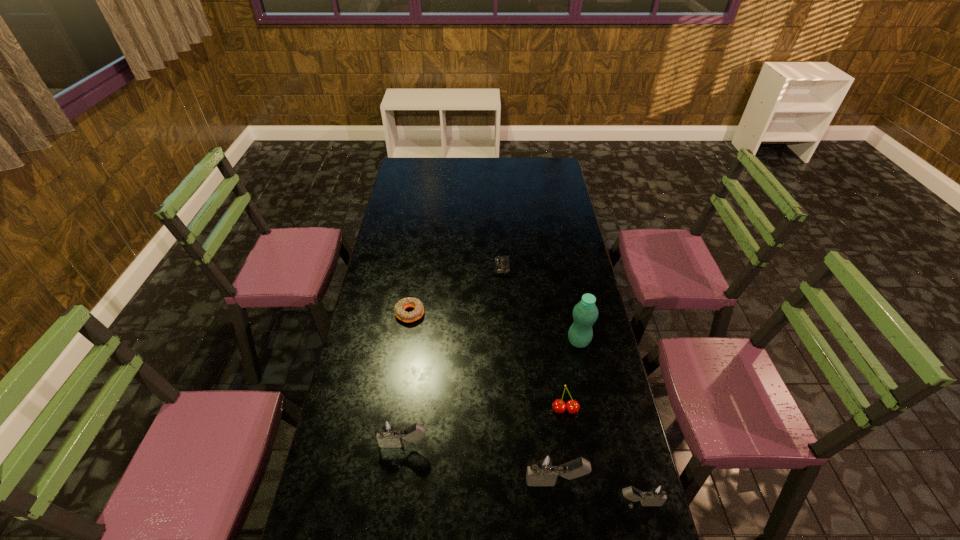
Identify the location of the leftmost igniter. (389, 435).

Find the location of a particular element. the third tallest object is located at coordinates (389, 435).

This screenshot has width=960, height=540. In order to click on the second igniter from left to right in this screenshot , I will do `click(543, 470)`.

The width and height of the screenshot is (960, 540). I want to click on the rightmost igniter, so click(656, 494).

You are a GUI agent. You are given a task and a screenshot of the screen. Output one action in this format:
    pyautogui.click(x=<x>, y=<y>)
    Task: Click on the alarm clock
    
    Given the screenshot: What is the action you would take?
    pyautogui.click(x=501, y=263)

You are a GUI agent. You are given a task and a screenshot of the screen. Output one action in this format:
    pyautogui.click(x=<x>, y=<y>)
    Task: Click on the shortest object
    
    Given the screenshot: What is the action you would take?
    pyautogui.click(x=501, y=263)

Where is `water bottle`? The image size is (960, 540). water bottle is located at coordinates (585, 313).

You are a GUI agent. You are given a task and a screenshot of the screen. Output one action in this format:
    pyautogui.click(x=<x>, y=<y>)
    Task: Click on the third farthest object
    
    Given the screenshot: What is the action you would take?
    pyautogui.click(x=585, y=313)

The width and height of the screenshot is (960, 540). Find the location of `the second farthest object`. the second farthest object is located at coordinates (417, 313).

Where is `doughnut`? Image resolution: width=960 pixels, height=540 pixels. doughnut is located at coordinates 417,313.